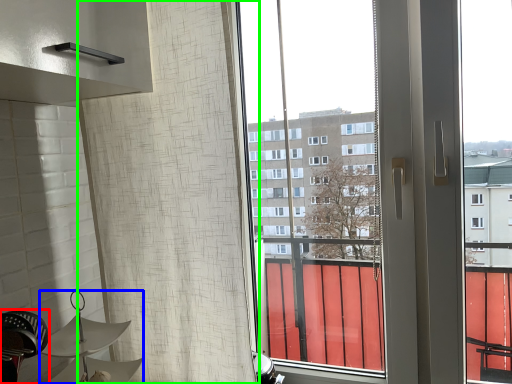
Question: Which object is positioned closest to swivel chair (highlighted by a red box)? Select from lamp (highlighted by a blue box) and shower curtain (highlighted by a green box).

Choices:
 (A) lamp
 (B) shower curtain

Answer: (A)